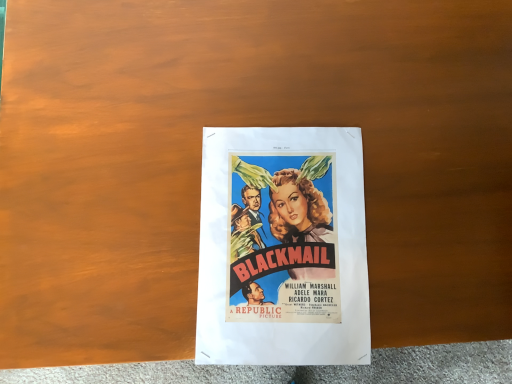
The image size is (512, 384). In order to click on vacant space behind matte paper poster at center in this screenshot , I will do `click(334, 59)`.